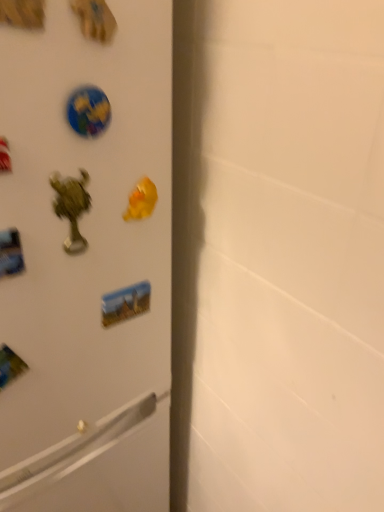
Question: Is glossy plastic globe at upper left, positioned as the 1th sticker in front-to-back order, shorter than matte plastic sticker at center, the 2th sticker from the top?

Choices:
 (A) no
 (B) yes

Answer: (B)

Question: Does glossy plastic globe at upper left, acting as the 2th sticker starting from the back, have a lesser width compared to matte plastic sticker at center, positioned as the 1th sticker in back-to-front order?

Choices:
 (A) no
 (B) yes

Answer: (B)

Question: Is glossy plastic globe at upper left, positioned as the 1th sticker in front-to-back order, smaller than matte plastic sticker at center, the 2th sticker from the top?

Choices:
 (A) yes
 (B) no

Answer: (A)

Question: Considering the relative positions of glossy plastic globe at upper left, positioned as the 1th sticker in front-to-back order, and matte plastic sticker at center, the 2th sticker from the top, in the image provided, is glossy plastic globe at upper left, positioned as the 1th sticker in front-to-back order, to the right of matte plastic sticker at center, the 2th sticker from the top, from the viewer's perspective?

Choices:
 (A) no
 (B) yes

Answer: (A)

Question: Is glossy plastic globe at upper left, marked as the 1th sticker in a top-to-bottom arrangement, next to matte plastic sticker at center, positioned as the 1th sticker in back-to-front order?

Choices:
 (A) no
 (B) yes

Answer: (A)

Question: Could matte plastic sticker at center, the 2th sticker positioned from the front, be considered to be inside glossy plastic globe at upper left, marked as the 1th sticker in a top-to-bottom arrangement?

Choices:
 (A) yes
 (B) no

Answer: (B)

Question: From a real-world perspective, is matte plastic sticker at center, positioned as the 1th sticker in back-to-front order, positioned under white matte refrigerator at left based on gravity?

Choices:
 (A) yes
 (B) no

Answer: (A)

Question: Is matte plastic sticker at center, positioned as the 1th sticker in back-to-front order, to the right of white matte refrigerator at left from the viewer's perspective?

Choices:
 (A) no
 (B) yes

Answer: (B)

Question: Is the depth of matte plastic sticker at center, the 2th sticker positioned from the front, greater than that of white matte refrigerator at left?

Choices:
 (A) no
 (B) yes

Answer: (B)

Question: Does matte plastic sticker at center, positioned as the 1th sticker in back-to-front order, have a larger size compared to white matte refrigerator at left?

Choices:
 (A) yes
 (B) no

Answer: (B)

Question: Is matte plastic sticker at center, the 1th sticker ordered from the bottom, directly adjacent to white matte refrigerator at left?

Choices:
 (A) no
 (B) yes

Answer: (A)

Question: Is matte plastic sticker at center, positioned as the 1th sticker in back-to-front order, facing away from white matte refrigerator at left?

Choices:
 (A) no
 (B) yes

Answer: (B)

Question: Considering the relative sizes of white matte refrigerator at left and glossy plastic globe at upper left, acting as the 2th sticker starting from the back, in the image provided, is white matte refrigerator at left smaller than glossy plastic globe at upper left, acting as the 2th sticker starting from the back,?

Choices:
 (A) yes
 (B) no

Answer: (B)